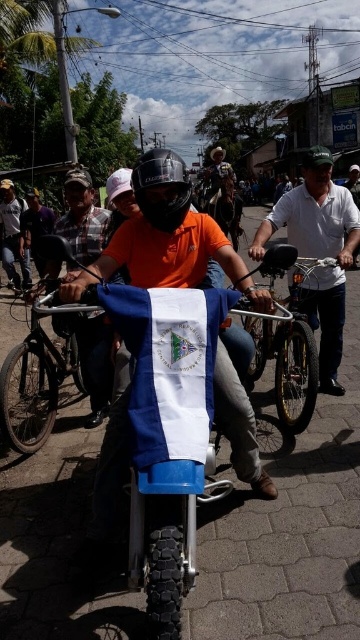
Which is more to the right, white cotton shirt at center or orange shirt at center?

white cotton shirt at center is more to the right.

Which of these two, white cotton shirt at center or orange shirt at center, stands shorter?

Standing shorter between the two is orange shirt at center.

Who is more distant from viewer, (340, 308) or (5, 200)?

The point (5, 200) is more distant.

Image resolution: width=360 pixels, height=640 pixels. I want to click on white cotton shirt at center, so click(x=317, y=252).

Can you confirm if white cotton shirt at center is positioned to the left of metallic silver bicycle at center?

No, white cotton shirt at center is not to the left of metallic silver bicycle at center.

Is white cotton shirt at center closer to camera compared to metallic silver bicycle at center?

No, white cotton shirt at center is further to the viewer.

What do you see at coordinates (317, 252) in the screenshot? The height and width of the screenshot is (640, 360). I see `white cotton shirt at center` at bounding box center [317, 252].

The width and height of the screenshot is (360, 640). I want to click on white cotton shirt at center, so click(x=317, y=252).

What do you see at coordinates (37, 378) in the screenshot? I see `blue matte bicycle at center` at bounding box center [37, 378].

Is point (51, 408) closer to viewer compared to point (14, 227)?

Yes.

Does point (62, 353) lie behind point (23, 264)?

No, it is not.

Where is `blue matte bicycle at center`? Image resolution: width=360 pixels, height=640 pixels. blue matte bicycle at center is located at coordinates click(37, 378).